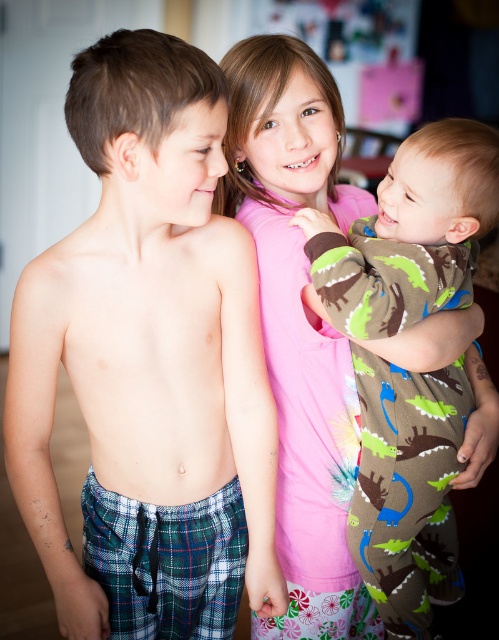
Can you confirm if plaid fabric pants at left is positioned to the right of brown fleece onesie at right?

No, plaid fabric pants at left is not to the right of brown fleece onesie at right.

Which is in front, point (44, 387) or point (355, 321)?

Point (355, 321) is more forward.

Does point (150, 161) come farther from viewer compared to point (390, 586)?

No, (150, 161) is in front of (390, 586).

Locate an element on the screen. Image resolution: width=499 pixels, height=640 pixels. plaid fabric pants at left is located at coordinates (149, 364).

Which of these two, brown fleece onesie at right or pink fabric at center, stands taller?

With more height is pink fabric at center.

Does brown fleece onesie at right lie behind pink fabric at center?

No.

Which is in front, point (456, 189) or point (299, 148)?

Positioned in front is point (456, 189).

This screenshot has width=499, height=640. I want to click on brown fleece onesie at right, so click(x=410, y=230).

Is plaid fabric pants at left thinner than pink fabric at center?

No.

I want to click on plaid fabric pants at left, so click(x=149, y=364).

Does point (176, 611) come in front of point (273, 132)?

No, (176, 611) is further to viewer.

At what (x,y) coordinates should I click in order to perform the action: click on plaid fabric pants at left. Please return your answer as a coordinate pair (x, y). The height and width of the screenshot is (640, 499). Looking at the image, I should click on (149, 364).